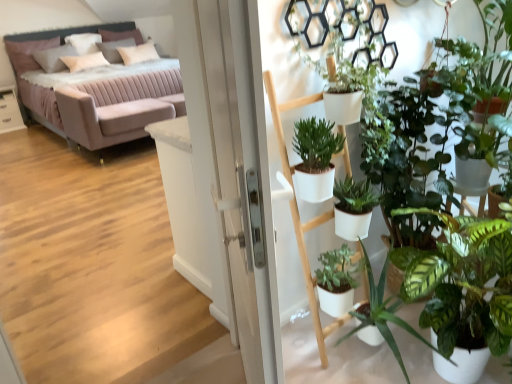
Question: Would you consider velvet pink couch at upper left to be distant from white soft pillow at upper left, acting as the 2th pillow starting from the right?

Choices:
 (A) yes
 (B) no

Answer: (A)

Question: Does velvet pink couch at upper left appear on the left side of white soft pillow at upper left, acting as the 2th pillow starting from the right?

Choices:
 (A) yes
 (B) no

Answer: (B)

Question: From the image's perspective, is velvet pink couch at upper left over white soft pillow at upper left, acting as the 2th pillow starting from the right?

Choices:
 (A) yes
 (B) no

Answer: (B)

Question: Is the position of velvet pink couch at upper left less distant than that of white soft pillow at upper left, the third pillow viewed from the left?

Choices:
 (A) yes
 (B) no

Answer: (A)

Question: Would you say velvet pink couch at upper left contains white soft pillow at upper left, the third pillow viewed from the left?

Choices:
 (A) no
 (B) yes

Answer: (B)

Question: Relative to white soft pillow at upper left, the third pillow viewed from the left, is white soft pillow at upper left, which is counted as the second pillow, starting from the left, in front or behind?

Choices:
 (A) behind
 (B) front

Answer: (B)

Question: Looking at their shapes, would you say white soft pillow at upper left, which is counted as the second pillow, starting from the left, is wider or thinner than white soft pillow at upper left, acting as the 2th pillow starting from the right?

Choices:
 (A) wide
 (B) thin

Answer: (B)

Question: From the image's perspective, is white soft pillow at upper left, positioned as the 3th pillow in right-to-left order, above or below white soft pillow at upper left, the third pillow viewed from the left?

Choices:
 (A) below
 (B) above

Answer: (A)

Question: From a real-world perspective, is white soft pillow at upper left, which is counted as the second pillow, starting from the left, physically located above or below white soft pillow at upper left, acting as the 2th pillow starting from the right?

Choices:
 (A) below
 (B) above

Answer: (A)

Question: Is point (138, 61) positioned closer to the camera than point (264, 311)?

Choices:
 (A) closer
 (B) farther

Answer: (B)

Question: In terms of size, does white soft pillow at upper left, which is the 1th pillow from right to left, appear bigger or smaller than white glossy screen door at center?

Choices:
 (A) big
 (B) small

Answer: (B)

Question: Considering the relative positions of white soft pillow at upper left, which is the 1th pillow from right to left, and white glossy screen door at center in the image provided, is white soft pillow at upper left, which is the 1th pillow from right to left, to the left or to the right of white glossy screen door at center?

Choices:
 (A) right
 (B) left

Answer: (B)

Question: From the image's perspective, is white soft pillow at upper left, which is the 1th pillow from right to left, located above or below white glossy screen door at center?

Choices:
 (A) above
 (B) below

Answer: (A)

Question: Relative to white glossy table at left, is velvet pink couch at upper left in front or behind?

Choices:
 (A) behind
 (B) front

Answer: (B)

Question: Do you think velvet pink couch at upper left is within white glossy table at left, or outside of it?

Choices:
 (A) inside
 (B) outside

Answer: (B)